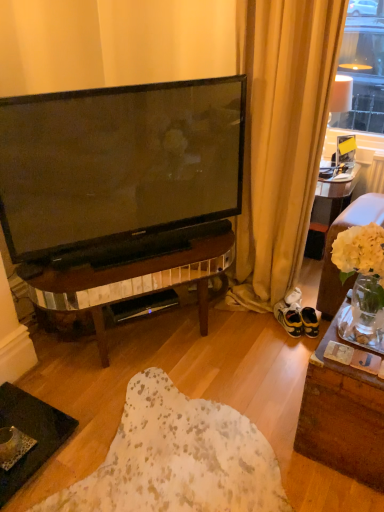
Question: Could you tell me if black plastic speaker at center is facing suede brown couch at right?

Choices:
 (A) yes
 (B) no

Answer: (B)

Question: From a real-world perspective, does black plastic speaker at center sit lower than suede brown couch at right?

Choices:
 (A) no
 (B) yes

Answer: (B)

Question: Would you say black plastic speaker at center is outside suede brown couch at right?

Choices:
 (A) yes
 (B) no

Answer: (A)

Question: Is black plastic speaker at center at the right side of suede brown couch at right?

Choices:
 (A) yes
 (B) no

Answer: (B)

Question: Would you say suede brown couch at right is part of black plastic speaker at center's contents?

Choices:
 (A) yes
 (B) no

Answer: (B)

Question: Is yellow suede sneakers at lower right wider or thinner than beige fabric curtain at upper right?

Choices:
 (A) wide
 (B) thin

Answer: (B)

Question: From the image's perspective, is yellow suede sneakers at lower right located above or below beige fabric curtain at upper right?

Choices:
 (A) below
 (B) above

Answer: (A)

Question: Considering their positions, is yellow suede sneakers at lower right located in front of or behind beige fabric curtain at upper right?

Choices:
 (A) front
 (B) behind

Answer: (B)

Question: Is yellow suede sneakers at lower right bigger or smaller than beige fabric curtain at upper right?

Choices:
 (A) big
 (B) small

Answer: (B)

Question: Is beige fabric curtain at upper right spatially inside suede brown couch at right, or outside of it?

Choices:
 (A) inside
 (B) outside

Answer: (B)

Question: Looking at their shapes, would you say beige fabric curtain at upper right is wider or thinner than suede brown couch at right?

Choices:
 (A) thin
 (B) wide

Answer: (A)

Question: In terms of size, does beige fabric curtain at upper right appear bigger or smaller than suede brown couch at right?

Choices:
 (A) big
 (B) small

Answer: (A)

Question: Considering the positions of beige fabric curtain at upper right and suede brown couch at right in the image, is beige fabric curtain at upper right taller or shorter than suede brown couch at right?

Choices:
 (A) tall
 (B) short

Answer: (A)

Question: Considering the positions of point (337, 289) and point (286, 309), is point (337, 289) closer or farther from the camera than point (286, 309)?

Choices:
 (A) closer
 (B) farther

Answer: (A)

Question: In terms of size, does suede brown couch at right appear bigger or smaller than yellow suede sneakers at lower right?

Choices:
 (A) big
 (B) small

Answer: (A)